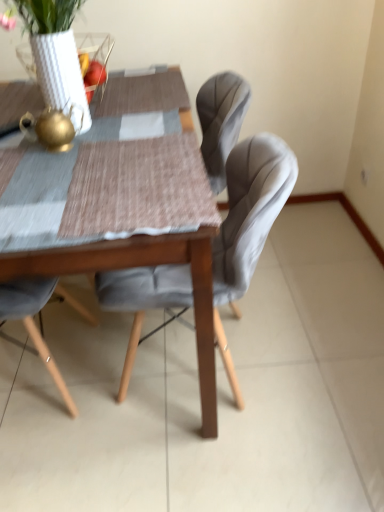
What do you see at coordinates (250, 210) in the screenshot? This screenshot has height=512, width=384. I see `velvet grey chair at center` at bounding box center [250, 210].

This screenshot has width=384, height=512. In order to click on white textured vase at upper left in this screenshot , I will do `click(62, 52)`.

Where is `velvet grey chair at center`? This screenshot has width=384, height=512. velvet grey chair at center is located at coordinates (250, 210).

Is the depth of wooden table at center less than that of white textured vase at upper left?

Yes, the depth of wooden table at center is less than that of white textured vase at upper left.

Would you say wooden table at center contains white textured vase at upper left?

No, white textured vase at upper left is located outside of wooden table at center.

Which of these two, wooden table at center or white textured vase at upper left, stands shorter?

white textured vase at upper left.

From the image's perspective, does wooden table at center appear lower than white textured vase at upper left?

Yes, from the image's perspective, wooden table at center is beneath white textured vase at upper left.

Considering the positions of points (234, 396) and (85, 52), is point (234, 396) farther from camera compared to point (85, 52)?

No, (234, 396) is closer to viewer.

Considering the relative sizes of velvet grey chair at center and white textured vase at upper left in the image provided, is velvet grey chair at center smaller than white textured vase at upper left?

Actually, velvet grey chair at center might be larger than white textured vase at upper left.

How distant is velvet grey chair at center from white textured vase at upper left?

21.38 inches.

Is point (216, 417) closer to camera compared to point (240, 230)?

That is False.

Which is more to the right, wooden table at center or velvet grey chair at center?

velvet grey chair at center is more to the right.

Looking at this image, from a real-world perspective, who is located lower, wooden table at center or velvet grey chair at center?

velvet grey chair at center is physically lower.

Looking at their sizes, would you say wooden table at center is wider or thinner than velvet grey chair at center?

In the image, wooden table at center appears to be wider than velvet grey chair at center.

Based on their positions, is white textured vase at upper left located to the left or right of velvet grey chair at center?

white textured vase at upper left is positioned on velvet grey chair at center's left side.

Is white textured vase at upper left turned away from velvet grey chair at center?

white textured vase at upper left does not have its back to velvet grey chair at center.

From the image's perspective, does white textured vase at upper left appear lower than velvet grey chair at center?

Incorrect, from the image's perspective, white textured vase at upper left is higher than velvet grey chair at center.

Identify the location of floral arrangement that is above the velvet grey chair at center (from the image's perspective). The image size is (384, 512). (62, 52).

Considering the sizes of objects white textured vase at upper left and wooden table at center in the image provided, who is wider, white textured vase at upper left or wooden table at center?

Wider between the two is wooden table at center.

Is white textured vase at upper left completely or partially outside of wooden table at center?

white textured vase at upper left is positioned outside wooden table at center.

Is white textured vase at upper left shorter than wooden table at center?

Yes.

Considering the points (110, 39) and (70, 258), which point is behind, point (110, 39) or point (70, 258)?

The point (110, 39) is more distant.

Is velvet grey chair at center with wooden table at center?

There is a gap between velvet grey chair at center and wooden table at center.

Does velvet grey chair at center have a lesser width compared to wooden table at center?

Correct, the width of velvet grey chair at center is less than that of wooden table at center.

From their relative heights in the image, would you say velvet grey chair at center is taller or shorter than wooden table at center?

In the image, velvet grey chair at center appears to be shorter than wooden table at center.

Based on the photo, does velvet grey chair at center come behind wooden table at center?

Yes, velvet grey chair at center is behind wooden table at center.

In the image, there is a wooden table at center. At what (x,y) coordinates should I click in order to perform the action: click on floral arrangement above it (from the image's perspective). Please return your answer as a coordinate pair (x, y). Looking at the image, I should click on (62, 52).

At what (x,y) coordinates should I click in order to perform the action: click on floral arrangement in front of the velvet grey chair at center. Please return your answer as a coordinate pair (x, y). The width and height of the screenshot is (384, 512). Looking at the image, I should click on (62, 52).

When comparing their distances from white textured vase at upper left, does wooden table at center or velvet grey chair at center seem closer?

Among the two, wooden table at center is located nearer to white textured vase at upper left.

From the image, which object appears to be nearer to velvet grey chair at center, wooden table at center or white textured vase at upper left?

wooden table at center is positioned closer to the anchor velvet grey chair at center.

Which object lies further to the anchor point wooden table at center, white textured vase at upper left or velvet grey chair at center?

The object further to wooden table at center is white textured vase at upper left.

When comparing their distances from white textured vase at upper left, does velvet grey chair at center or wooden table at center seem closer?

The object closer to white textured vase at upper left is wooden table at center.

From the image, which object appears to be nearer to velvet grey chair at center, white textured vase at upper left or wooden table at center?

Among the two, wooden table at center is located nearer to velvet grey chair at center.

Considering their positions, is velvet grey chair at center positioned closer to wooden table at center than white textured vase at upper left?

Based on the image, velvet grey chair at center appears to be nearer to wooden table at center.

Find the location of `kitchen & dining room table that lies between white textured vase at upper left and velvet grey chair at center from top to bottom`. kitchen & dining room table that lies between white textured vase at upper left and velvet grey chair at center from top to bottom is located at coordinates (142, 265).